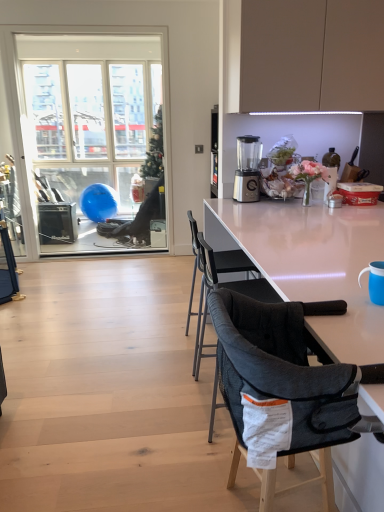
I want to click on free space to the left of blue plastic cup at right, so click(316, 301).